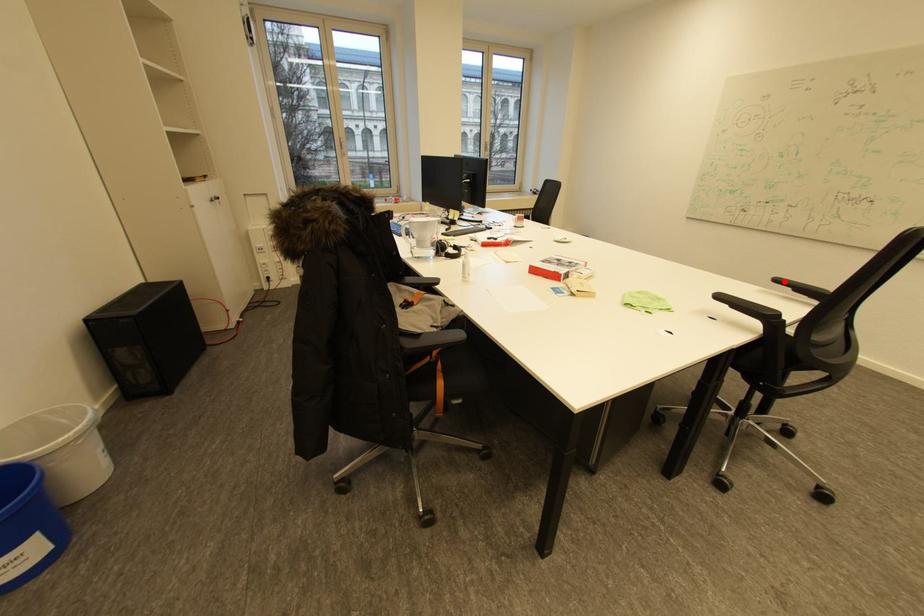
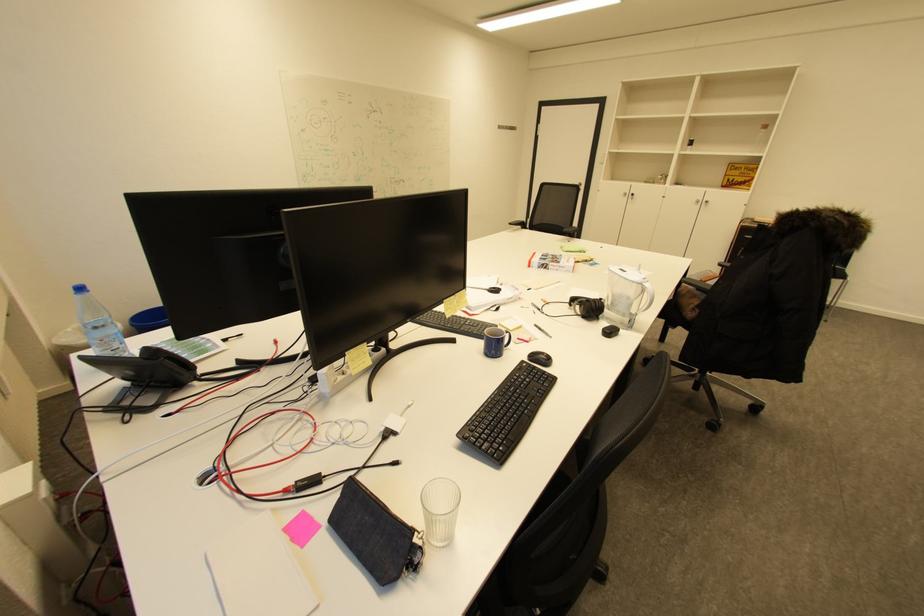
Where in the second image is the point corresponding to the highlighted location from the first image?

(517, 225)